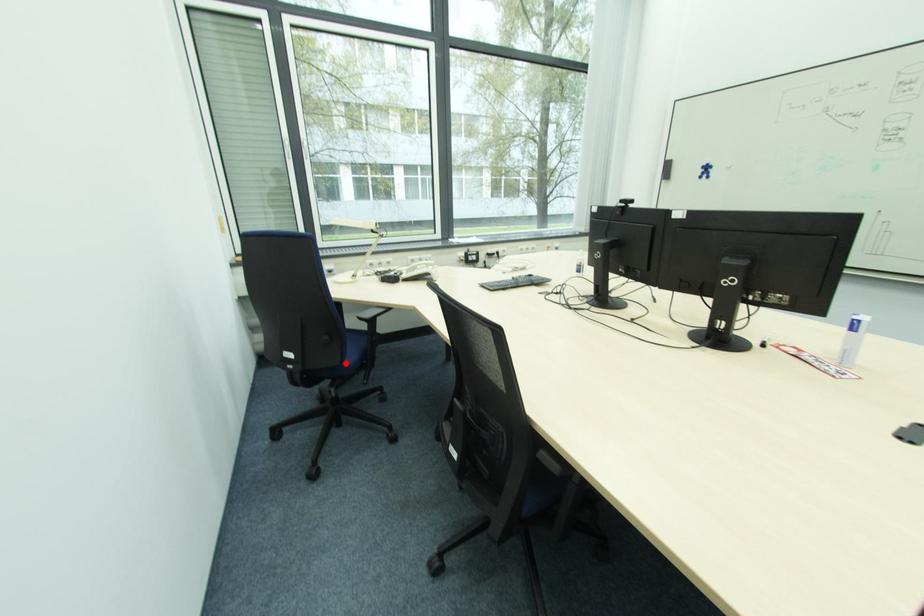
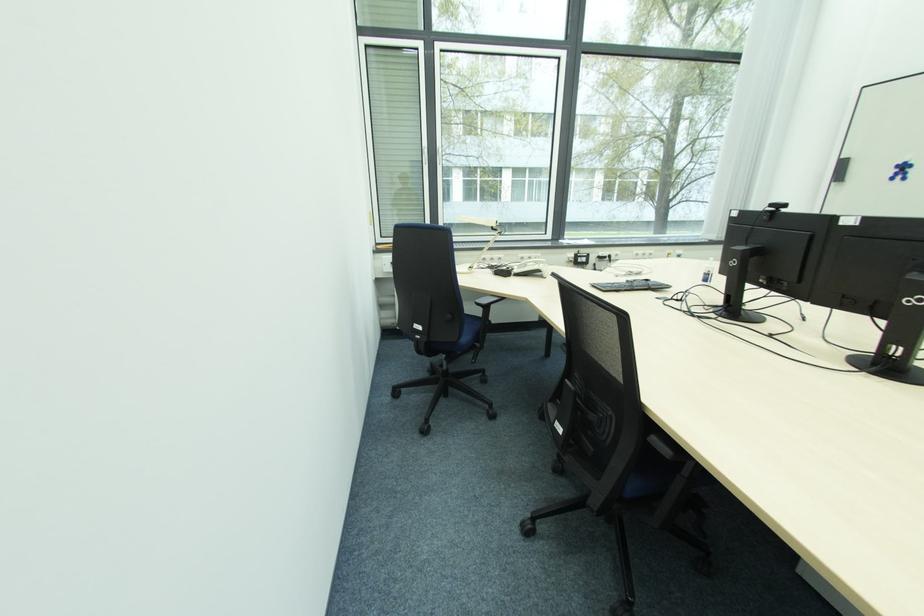
In the second image, find the point that corresponds to the highlighted location in the first image.

(463, 341)